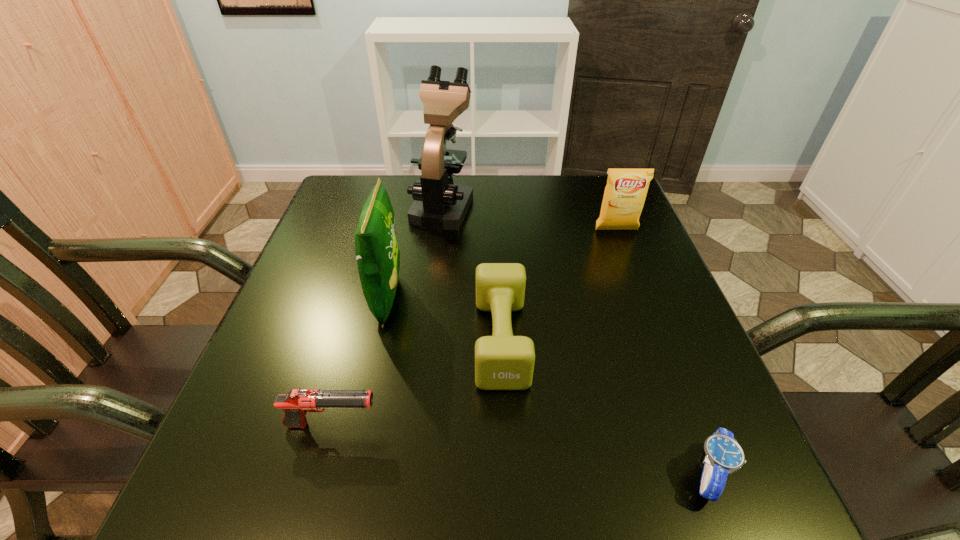
The height and width of the screenshot is (540, 960). In order to click on free space that satisfies the following two spatial constraints: 1. on the front-facing side of the nearest object; 2. on the left side of the nearer crisp (potato chip) in this screenshot , I will do `click(348, 474)`.

At what (x,y) coordinates should I click in order to perform the action: click on vacant space that satisfies the following two spatial constraints: 1. on the front side of the tallest object; 2. on the right side of the dumbbell. Please return your answer as a coordinate pair (x, y). The image size is (960, 540). Looking at the image, I should click on (427, 340).

Locate an element on the screen. free region that satisfies the following two spatial constraints: 1. on the front side of the tallest object; 2. at the aiming end of the fifth farthest object is located at coordinates 418,425.

Identify the location of blank space that satisfies the following two spatial constraints: 1. on the front side of the tallest object; 2. on the left side of the dumbbell. (427, 340).

Identify the location of free space in the image that satisfies the following two spatial constraints: 1. on the front of the third tallest object with the logo; 2. on the front-facing side of the left crisp (potato chip). (643, 298).